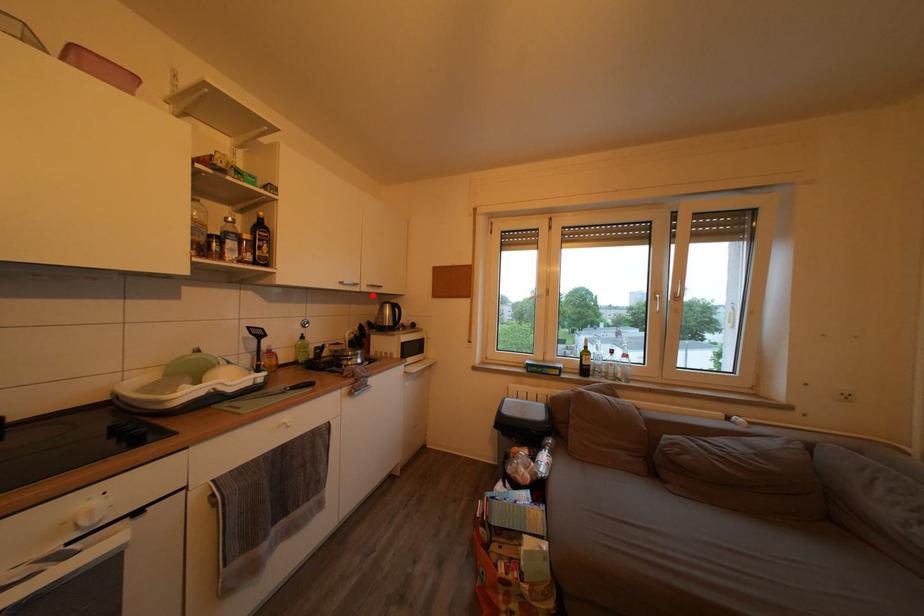
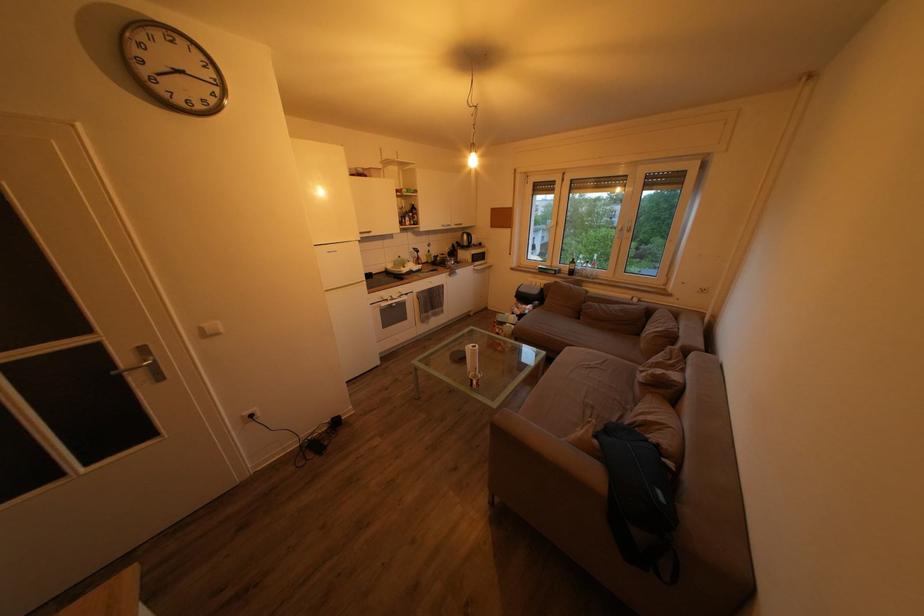
Find the pixel in the second image that matches the highlighted location in the first image.

(462, 233)